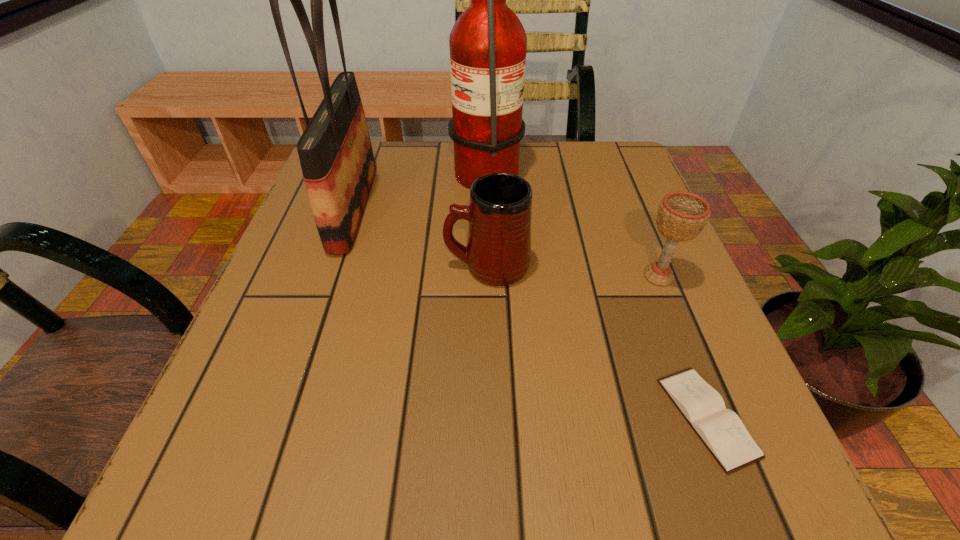
At what (x,y) coordinates should I click in order to perform the action: click on vacant position located 0.110m on the front-facing side of the shopping bag. Please return your answer as a coordinate pair (x, y). This screenshot has height=540, width=960. Looking at the image, I should click on (426, 208).

Where is `vacant space situated 0.190m on the side of the mug with the handle`? This screenshot has height=540, width=960. vacant space situated 0.190m on the side of the mug with the handle is located at coordinates (341, 266).

Where is `free space located 0.110m on the back of the chalice`? The width and height of the screenshot is (960, 540). free space located 0.110m on the back of the chalice is located at coordinates (637, 225).

Where is `free space located on the left of the shortest object`? free space located on the left of the shortest object is located at coordinates (609, 417).

Locate an element on the screen. fire extinguisher that is at the far edge is located at coordinates (488, 44).

Image resolution: width=960 pixels, height=540 pixels. What are the coordinates of `shopping bag situated at the far edge` in the screenshot? It's located at (335, 152).

Locate an element on the screen. object present at the near edge is located at coordinates (721, 430).

Find the location of a particular element. This screenshot has height=540, width=960. object present at the left edge is located at coordinates (335, 152).

The width and height of the screenshot is (960, 540). I want to click on chalice present at the right edge, so click(x=681, y=216).

Locate an element on the screen. The width and height of the screenshot is (960, 540). diary at the right edge is located at coordinates (721, 430).